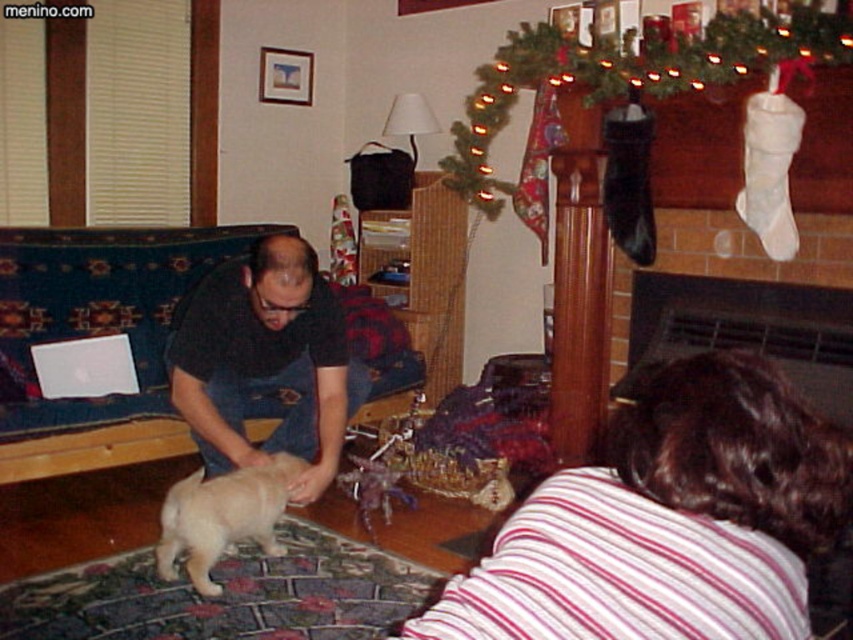
Question: Which is nearer to the dark blue denim apron at center?

Choices:
 (A) blue fabric couch at left
 (B) light beige fur at center

Answer: (B)

Question: Does blue fabric couch at left have a larger size compared to dark blue denim apron at center?

Choices:
 (A) yes
 (B) no

Answer: (A)

Question: Considering the relative positions of white striped shirt at lower right and blue fabric couch at left in the image provided, where is white striped shirt at lower right located with respect to blue fabric couch at left?

Choices:
 (A) right
 (B) left

Answer: (A)

Question: Which of the following is the closest to the observer?

Choices:
 (A) 758,49
 (B) 199,404
 (C) 585,621

Answer: (C)

Question: Based on their relative distances, which object is nearer to the blue fabric couch at left?

Choices:
 (A) light beige fur at center
 (B) white striped shirt at lower right
 (C) white fabric stocking at upper right

Answer: (A)

Question: Can you confirm if white fabric stocking at upper right is thinner than light beige fur at center?

Choices:
 (A) no
 (B) yes

Answer: (A)